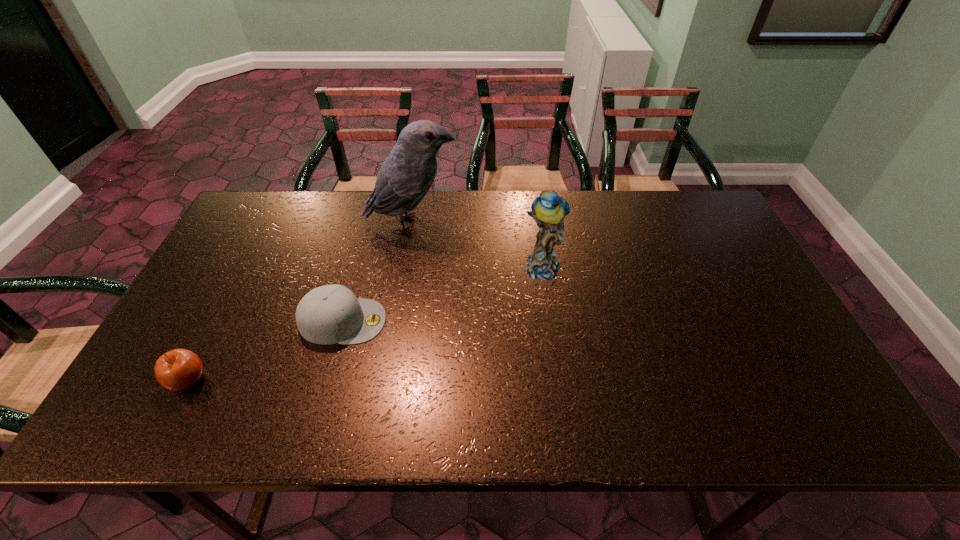
This screenshot has width=960, height=540. What are the coordinates of `free space that is in between the farthest object and the third shortest object` in the screenshot? It's located at (477, 246).

Choose which object is the third nearest neighbor to the third nearest object. Please provide its 2D coordinates. Your answer should be formatted as a tuple, i.e. [(x, y)], where the tuple contains the x and y coordinates of a point satisfying the conditions above.

[(179, 369)]

Select which object is the second closest to the farthest object. Please provide its 2D coordinates. Your answer should be formatted as a tuple, i.e. [(x, y)], where the tuple contains the x and y coordinates of a point satisfying the conditions above.

[(330, 314)]

Where is `vacant region that satisfies the following two spatial constraints: 1. on the face of the shorter parrot; 2. on the front-facing side of the shortest object`? This screenshot has width=960, height=540. vacant region that satisfies the following two spatial constraints: 1. on the face of the shorter parrot; 2. on the front-facing side of the shortest object is located at coordinates (550, 321).

Locate an element on the screen. vacant area in the image that satisfies the following two spatial constraints: 1. on the face of the rightmost object; 2. on the front-facing side of the cap is located at coordinates (550, 321).

Image resolution: width=960 pixels, height=540 pixels. Find the location of `free location that satisfies the following two spatial constraints: 1. on the front-facing side of the left parrot; 2. on the front side of the leftmost object`. free location that satisfies the following two spatial constraints: 1. on the front-facing side of the left parrot; 2. on the front side of the leftmost object is located at coordinates (385, 381).